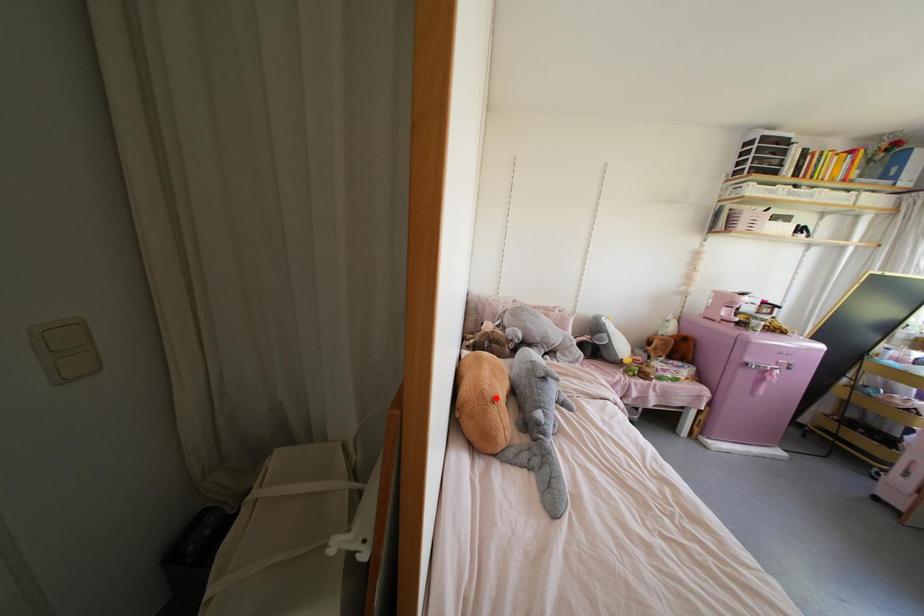
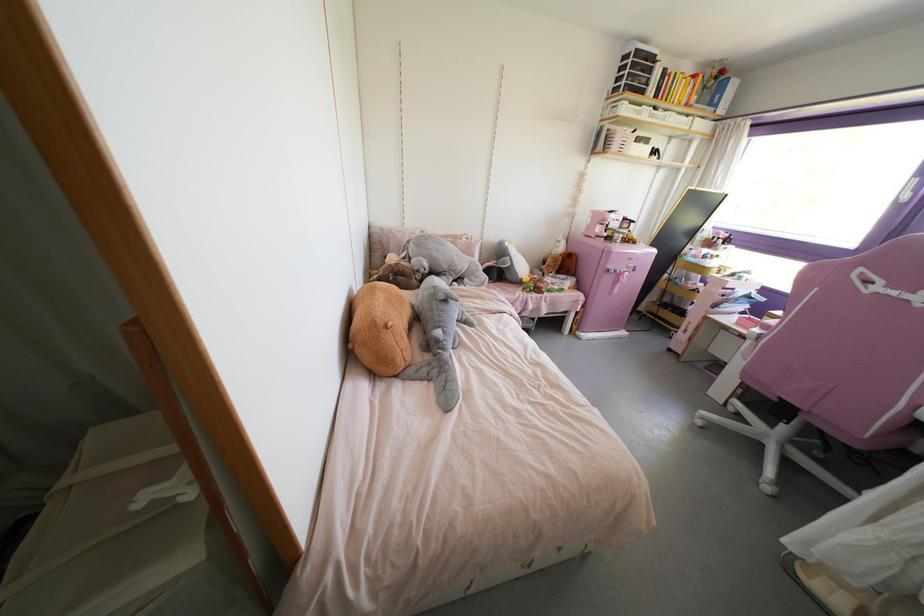
Where in the second image is the point corresponding to the highlighted location from the first image?

(390, 323)